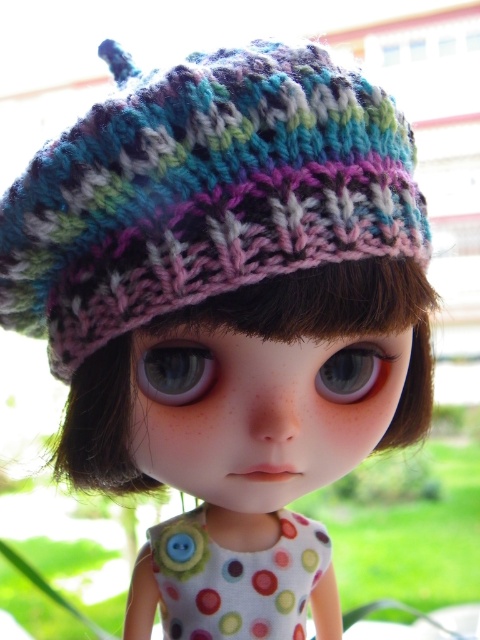
Question: Can you confirm if polka dot fabric dress at center is smaller than blue glossy eye at center?

Choices:
 (A) no
 (B) yes

Answer: (A)

Question: Is polka dot fabric dress at center positioned behind blue glossy eye at center?

Choices:
 (A) no
 (B) yes

Answer: (B)

Question: Can you confirm if polka dot fabric dress at center is positioned above blue glossy eye at center?

Choices:
 (A) no
 (B) yes

Answer: (A)

Question: Which point appears farthest from the camera in this image?

Choices:
 (A) (256, 589)
 (B) (380, 387)

Answer: (A)

Question: Which point is farther to the camera?

Choices:
 (A) (328, 372)
 (B) (214, 624)
 (C) (180, 346)

Answer: (B)

Question: Which point appears closest to the camera in this image?

Choices:
 (A) (344, 396)
 (B) (175, 529)

Answer: (A)